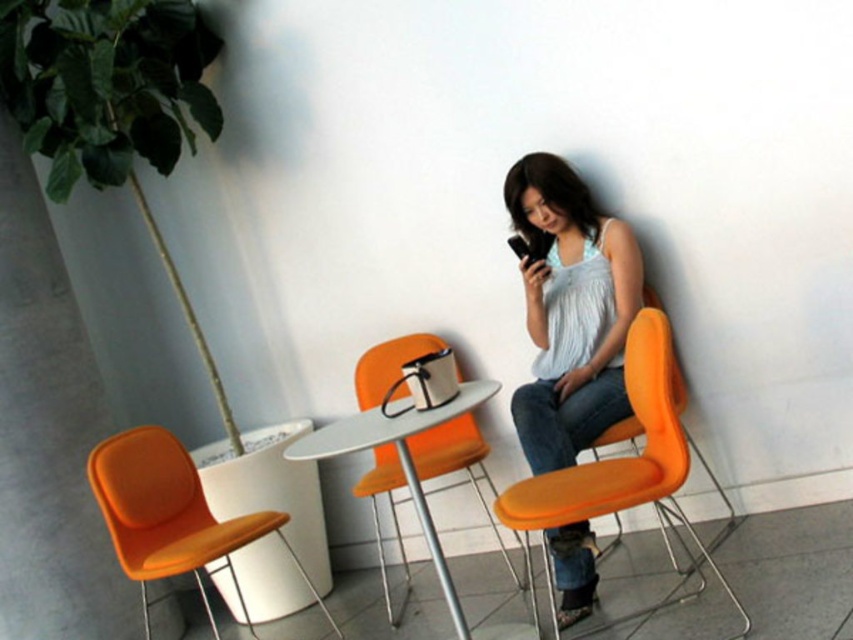
Which of these two, orange fabric chair at right or orange fabric chair at left, stands shorter?

orange fabric chair at left

You are a GUI agent. You are given a task and a screenshot of the screen. Output one action in this format:
    pyautogui.click(x=<x>, y=<y>)
    Task: Click on the orange fabric chair at right
    The width and height of the screenshot is (853, 640).
    Given the screenshot: What is the action you would take?
    pyautogui.click(x=619, y=461)

At what (x,y) coordinates should I click in order to perform the action: click on orange fabric chair at right. Please return your answer as a coordinate pair (x, y). The height and width of the screenshot is (640, 853). Looking at the image, I should click on (619, 461).

This screenshot has height=640, width=853. Identify the location of matte white tank top at center. (570, 310).

Between point (614, 266) and point (386, 598), which one is positioned in front?

Positioned in front is point (614, 266).

This screenshot has width=853, height=640. I want to click on matte white tank top at center, so click(570, 310).

Is point (547, 172) less distant than point (113, 488)?

No, it is behind (113, 488).

From the picture: Does matte white tank top at center have a greater height compared to orange fabric chair at left?

Yes.

Locate an element on the screen. The height and width of the screenshot is (640, 853). matte white tank top at center is located at coordinates (570, 310).